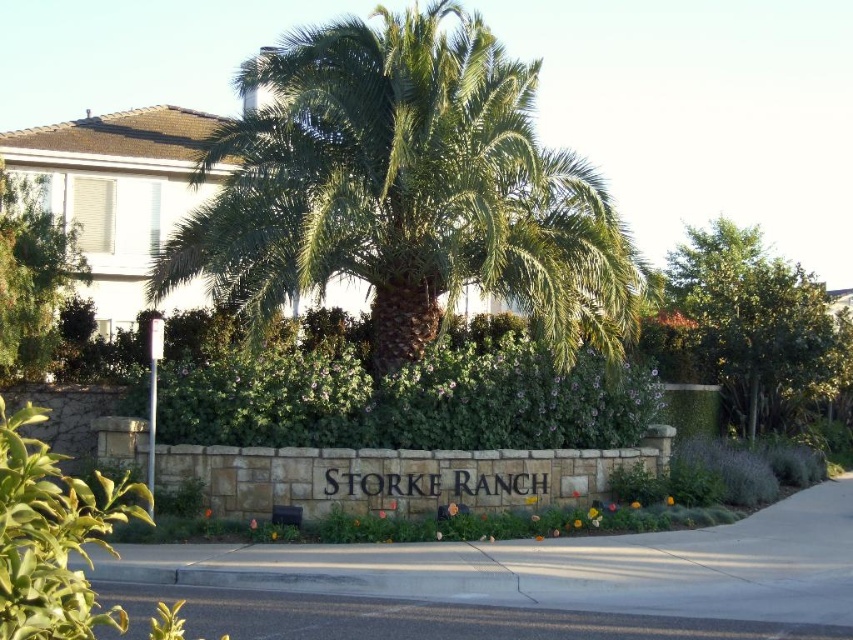
Question: Which of these objects is positioned farthest from the green leafy tree at right?

Choices:
 (A) green leafy palm tree at center
 (B) green leafy tree at left

Answer: (B)

Question: Can you confirm if green leafy bush at center is positioned below green leafy tree at left?

Choices:
 (A) no
 (B) yes

Answer: (B)

Question: Does green leafy bush at center appear under green leafy tree at right?

Choices:
 (A) yes
 (B) no

Answer: (A)

Question: Which point is closer to the camera taking this photo?

Choices:
 (A) (720, 358)
 (B) (408, 396)

Answer: (B)

Question: Which of the following is the closest to the observer?

Choices:
 (A) (379, 433)
 (B) (33, 321)
 (C) (381, 216)

Answer: (B)

Question: Is green leafy palm tree at center thinner than green leafy bush at center?

Choices:
 (A) yes
 (B) no

Answer: (B)